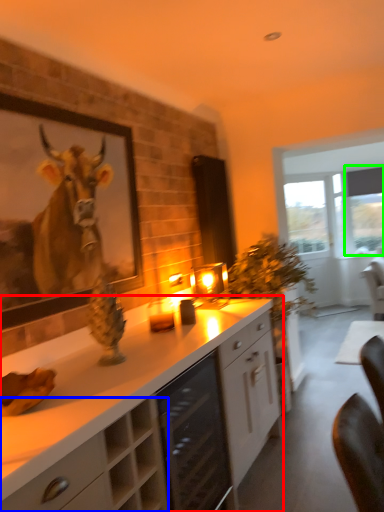
Question: Which object is positioned closest to cabinetry (highlighted by a red box)? Select from cabinetry (highlighted by a blue box) and window screen (highlighted by a green box).

Choices:
 (A) cabinetry
 (B) window screen

Answer: (A)